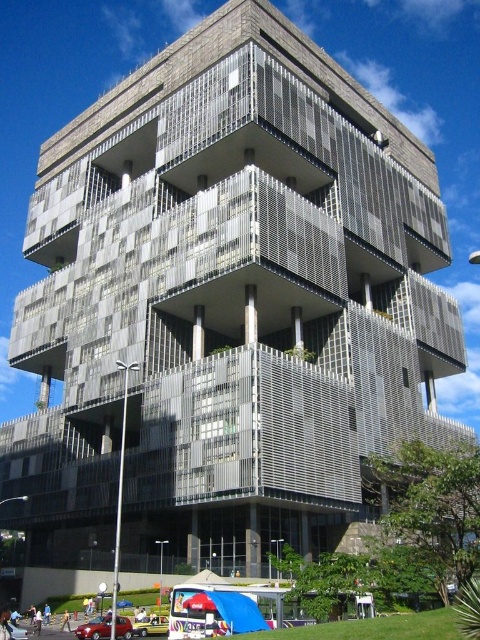
Question: Is the position of yellow matte car at lower center more distant than that of metallic silver car at lower left?

Choices:
 (A) no
 (B) yes

Answer: (B)

Question: Which point is farther to the camera?

Choices:
 (A) (8, 621)
 (B) (128, 618)
 (C) (136, 628)

Answer: (A)

Question: Can you confirm if yellow matte car at lower center is wider than metallic silver car at lower left?

Choices:
 (A) no
 (B) yes

Answer: (A)

Question: Which is farther from the metallic silver car at lower left?

Choices:
 (A) yellow matte car at lower center
 (B) matte red car at lower left

Answer: (A)

Question: Which point is farther from the camera taking this photo?

Choices:
 (A) (139, 624)
 (B) (26, 632)
 (C) (75, 632)

Answer: (B)

Question: Can you confirm if matte red car at lower left is positioned below yellow matte car at lower center?

Choices:
 (A) no
 (B) yes

Answer: (A)